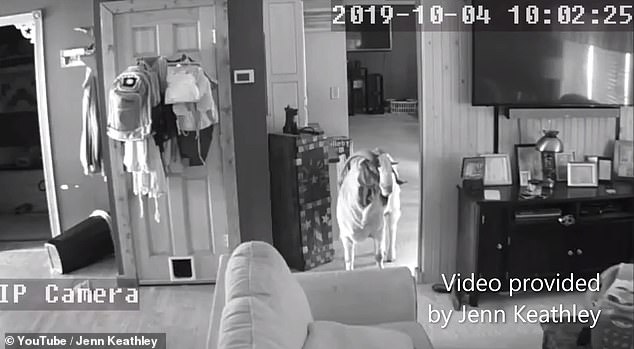
Locate an element on the screen. tv is located at coordinates (487, 81).